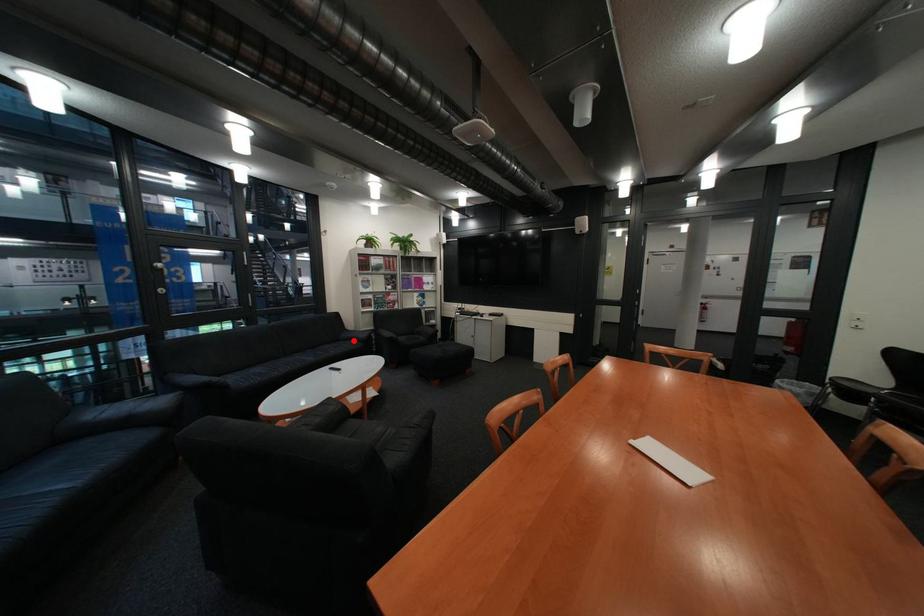
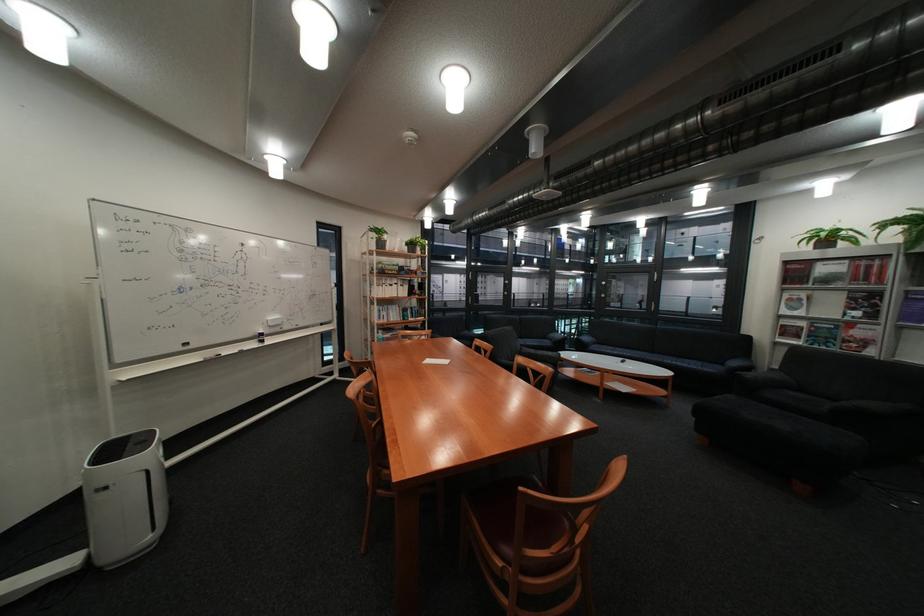
The point at the highlighted location is marked in the first image. Where is the corresponding point in the second image?

(737, 363)